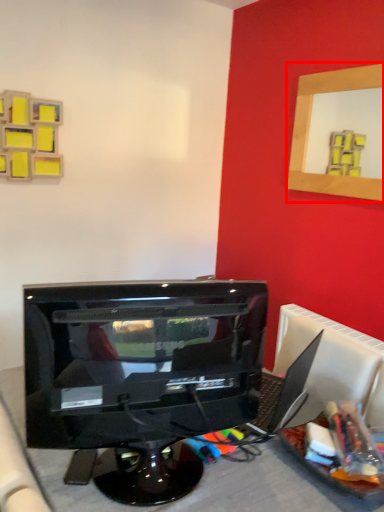
Question: Considering the relative positions of picture frame (annotated by the red box) and computer monitor in the image provided, where is picture frame (annotated by the red box) located with respect to the staircase?

Choices:
 (A) left
 (B) right

Answer: (B)